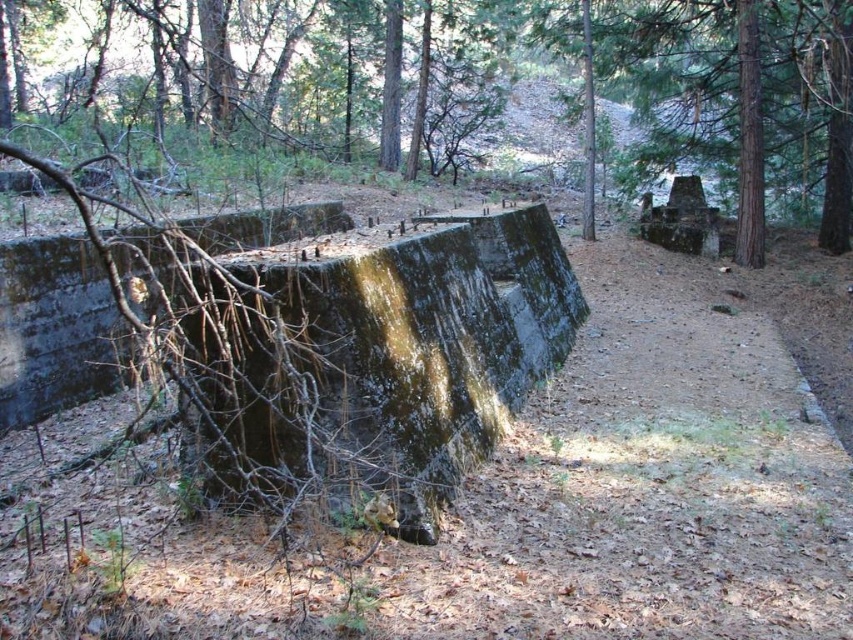
Is green mossy concrete at center positioned behind green mossy concrete wall at center?

No, it is not.

Is point (556, 323) in front of point (618, 161)?

Yes, it is.

Find the location of a particular element. Image resolution: width=853 pixels, height=640 pixels. green mossy concrete at center is located at coordinates (428, 340).